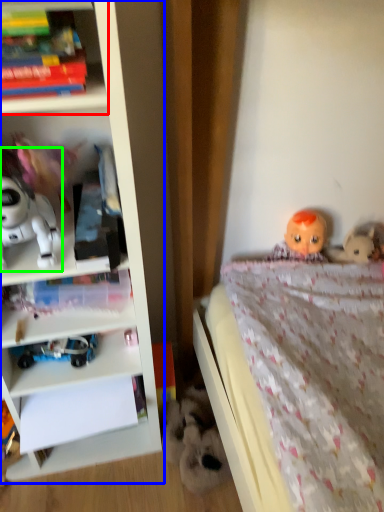
Question: Considering the real-world distances, which object is closest to shelf (highlighted by a red box)? bookcase (highlighted by a blue box) or toy (highlighted by a green box).

Choices:
 (A) bookcase
 (B) toy

Answer: (B)